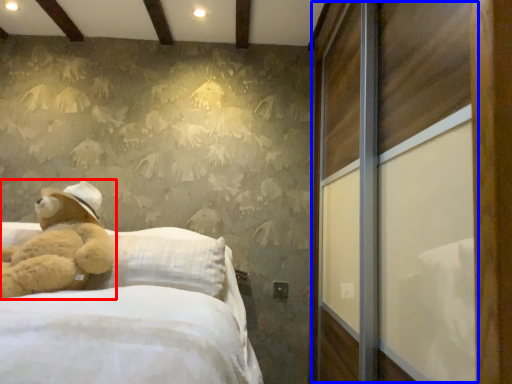
Question: Which of the following is the farthest to the observer, teddy bear (highlighted by a red box) or screen door (highlighted by a blue box)?

Choices:
 (A) teddy bear
 (B) screen door

Answer: (A)